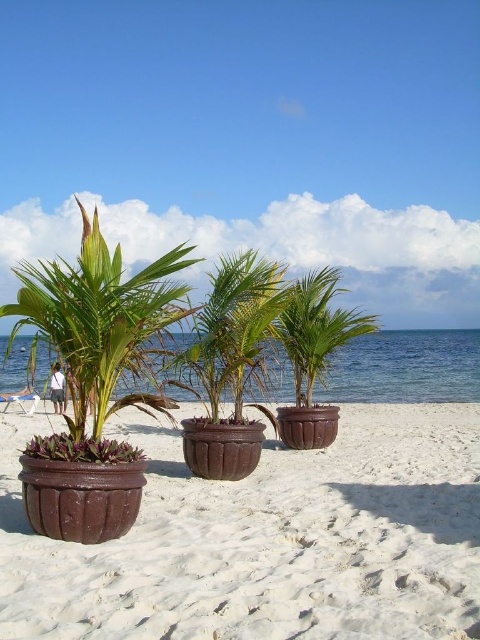
Which is below, brown textured sand at center or matte brown pot at left?

Positioned lower is brown textured sand at center.

Does brown textured sand at center appear on the left side of matte brown pot at left?

In fact, brown textured sand at center is to the right of matte brown pot at left.

Measure the distance between brown textured sand at center and camera.

brown textured sand at center and camera are 3.12 meters apart from each other.

Where is `brown textured sand at center`? The image size is (480, 640). brown textured sand at center is located at coordinates (265, 540).

In the scene shown: Is matte brown pot at left positioned before brown textured pot at center?

Yes, matte brown pot at left is closer to the viewer.

Who is positioned more to the right, matte brown pot at left or brown textured pot at center?

Positioned to the right is brown textured pot at center.

Between point (164, 269) and point (284, 316), which one is positioned behind?

Positioned behind is point (284, 316).

Locate an element on the screen. matte brown pot at left is located at coordinates (100, 321).

Which of these two, brown textured sand at center or brown textured pot at center, stands taller?

Standing taller between the two is brown textured pot at center.

Is point (188, 470) positioned after point (300, 289)?

No, (188, 470) is in front of (300, 289).

At what (x,y) coordinates should I click in order to perform the action: click on brown textured sand at center. Please return your answer as a coordinate pair (x, y). The width and height of the screenshot is (480, 640). Looking at the image, I should click on (265, 540).